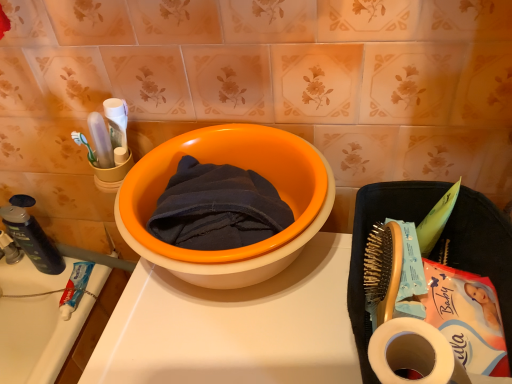
The image size is (512, 384). Find the location of `white matte toilet paper at lower right`. white matte toilet paper at lower right is located at coordinates (413, 353).

The image size is (512, 384). In order to click on dark blue cotton towel at center in this screenshot , I will do `click(217, 208)`.

What do you see at coordinates (217, 208) in the screenshot? The height and width of the screenshot is (384, 512). I see `dark blue cotton towel at center` at bounding box center [217, 208].

The height and width of the screenshot is (384, 512). I want to click on white toothpaste tube at lower left, placed as the second stationery when sorted from left to right, so click(75, 288).

Where is `white matte toilet paper at lower right`? white matte toilet paper at lower right is located at coordinates (413, 353).

From a real-world perspective, which is physically above, orange plastic basin at center or dark blue cotton towel at center?

dark blue cotton towel at center, from a real-world perspective.

Considering the sizes of objects orange plastic basin at center and dark blue cotton towel at center in the image provided, who is bigger, orange plastic basin at center or dark blue cotton towel at center?

With larger size is orange plastic basin at center.

Considering the relative sizes of orange plastic basin at center and dark blue cotton towel at center in the image provided, is orange plastic basin at center shorter than dark blue cotton towel at center?

In fact, orange plastic basin at center may be taller than dark blue cotton towel at center.

Is orange plastic basin at center spatially inside dark blue cotton towel at center, or outside of it?

The correct answer is: outside.

How many degrees apart are the facing directions of white toothpaste tube at lower left, the 1th stationery from the right, and orange plastic basin at center?

The facing directions of white toothpaste tube at lower left, the 1th stationery from the right, and orange plastic basin at center are 12.1 degrees apart.

Consider the image. Is white toothpaste tube at lower left, placed as the second stationery when sorted from left to right, oriented towards orange plastic basin at center?

No, white toothpaste tube at lower left, placed as the second stationery when sorted from left to right, is not facing towards orange plastic basin at center.

Considering the sizes of objects white toothpaste tube at lower left, the 1th stationery from the right, and orange plastic basin at center in the image provided, who is smaller, white toothpaste tube at lower left, the 1th stationery from the right, or orange plastic basin at center?

white toothpaste tube at lower left, the 1th stationery from the right, is smaller.

From a real-world perspective, is white toothpaste tube at lower left, placed as the second stationery when sorted from left to right, physically below orange plastic basin at center?

Yes, from a real-world perspective, white toothpaste tube at lower left, placed as the second stationery when sorted from left to right, is below orange plastic basin at center.

What are the coordinates of `toilet paper below the orange plastic basin at center (from the image's perspective)` in the screenshot? It's located at (413, 353).

From a real-world perspective, is white matte toilet paper at lower right beneath orange plastic basin at center?

No, from a real-world perspective, white matte toilet paper at lower right is not under orange plastic basin at center.

Considering the relative positions of white matte toilet paper at lower right and orange plastic basin at center in the image provided, is white matte toilet paper at lower right to the left of orange plastic basin at center from the viewer's perspective?

Incorrect, white matte toilet paper at lower right is not on the left side of orange plastic basin at center.

Are white matte toilet paper at lower right and orange plastic basin at center far apart?

No, white matte toilet paper at lower right is not far away from orange plastic basin at center.

Would you say dark blue plastic soap dispenser at left, which is the 1th stationery in left-to-right order, is inside or outside dark blue cotton towel at center?

dark blue plastic soap dispenser at left, which is the 1th stationery in left-to-right order, is outside dark blue cotton towel at center.

In the scene shown: From the image's perspective, is dark blue plastic soap dispenser at left, which is the 1th stationery in left-to-right order, on top of dark blue cotton towel at center?

No, from the image's perspective, dark blue plastic soap dispenser at left, which is the 1th stationery in left-to-right order, is not above dark blue cotton towel at center.

Considering the positions of objects dark blue plastic soap dispenser at left, which is the 1th stationery in left-to-right order, and dark blue cotton towel at center in the image provided, who is more to the left, dark blue plastic soap dispenser at left, which is the 1th stationery in left-to-right order, or dark blue cotton towel at center?

Positioned to the left is dark blue plastic soap dispenser at left, which is the 1th stationery in left-to-right order.

Based on the photo, from a real-world perspective, is white toothpaste tube at lower left, the 1th stationery from the right, positioned above or below white matte toilet paper at lower right?

From a real-world perspective, white toothpaste tube at lower left, the 1th stationery from the right, is physically below white matte toilet paper at lower right.

How many degrees apart are the facing directions of white toothpaste tube at lower left, the 1th stationery from the right, and white matte toilet paper at lower right?

They differ by 12.1 degrees in their facing directions.

From the image's perspective, would you say white toothpaste tube at lower left, the 1th stationery from the right, is positioned over white matte toilet paper at lower right?

Actually, white toothpaste tube at lower left, the 1th stationery from the right, appears below white matte toilet paper at lower right in the image.

Is white toothpaste tube at lower left, the 1th stationery from the right, inside orange plastic basin at center?

Definitely not — white toothpaste tube at lower left, the 1th stationery from the right, is not inside orange plastic basin at center.

Is orange plastic basin at center bigger than white toothpaste tube at lower left, the 1th stationery from the right?

Yes.

Is orange plastic basin at center placed right next to white toothpaste tube at lower left, placed as the second stationery when sorted from left to right?

No, orange plastic basin at center is not with white toothpaste tube at lower left, placed as the second stationery when sorted from left to right.

Which object is positioned more to the left, orange plastic basin at center or white toothpaste tube at lower left, the 1th stationery from the right?

white toothpaste tube at lower left, the 1th stationery from the right.

Can you confirm if orange plastic basin at center is positioned to the right of dark blue plastic soap dispenser at left, which is the 1th stationery in left-to-right order?

Yes.

Between orange plastic basin at center and dark blue plastic soap dispenser at left, which is counted as the 2th stationery, starting from the right, which one has larger width?

With larger width is orange plastic basin at center.

From the orange plastic basin at center, count 1st stationerys backward and point to it. Please provide its 2D coordinates.

[(31, 235)]

Considering the positions of objects orange plastic basin at center and dark blue plastic soap dispenser at left, which is the 1th stationery in left-to-right order, in the image provided, who is in front, orange plastic basin at center or dark blue plastic soap dispenser at left, which is the 1th stationery in left-to-right order,?

orange plastic basin at center is closer to the camera.

You are a GUI agent. You are given a task and a screenshot of the screen. Output one action in this format:
    pyautogui.click(x=<x>, y=<y>)
    Task: Click on the basin beneath the dark blue cotton towel at center (from a real-world perspective)
    The width and height of the screenshot is (512, 384).
    Given the screenshot: What is the action you would take?
    pyautogui.click(x=240, y=167)

Find the location of `basin that is above the white toothpaste tube at lower left, the 1th stationery from the right (from the image's perspective)`. basin that is above the white toothpaste tube at lower left, the 1th stationery from the right (from the image's perspective) is located at coordinates (240, 167).

Based on their spatial positions, is dark blue plastic soap dispenser at left, which is counted as the 2th stationery, starting from the right, or dark blue cotton towel at center closer to white toothpaste tube at lower left, the 1th stationery from the right?

Among the two, dark blue plastic soap dispenser at left, which is counted as the 2th stationery, starting from the right, is located nearer to white toothpaste tube at lower left, the 1th stationery from the right.

Considering their positions, is orange plastic basin at center positioned further to white matte toilet paper at lower right than white toothpaste tube at lower left, the 1th stationery from the right?

white toothpaste tube at lower left, the 1th stationery from the right, lies further to white matte toilet paper at lower right than the other object.

Based on their spatial positions, is dark blue cotton towel at center or dark blue plastic soap dispenser at left, which is the 1th stationery in left-to-right order, closer to white toothpaste tube at lower left, placed as the second stationery when sorted from left to right?

dark blue plastic soap dispenser at left, which is the 1th stationery in left-to-right order, lies closer to white toothpaste tube at lower left, placed as the second stationery when sorted from left to right, than the other object.

Which object lies nearer to the anchor point dark blue cotton towel at center, orange plastic basin at center or dark blue plastic soap dispenser at left, which is counted as the 2th stationery, starting from the right?

orange plastic basin at center is positioned closer to the anchor dark blue cotton towel at center.

Based on the photo, from the image, which object appears to be nearer to white toothpaste tube at lower left, placed as the second stationery when sorted from left to right, orange plastic basin at center or white matte toilet paper at lower right?

orange plastic basin at center is closer to white toothpaste tube at lower left, placed as the second stationery when sorted from left to right.

From the picture: Estimate the real-world distances between objects in this image. Which object is closer to orange plastic basin at center, white toothpaste tube at lower left, the 1th stationery from the right, or dark blue cotton towel at center?

Based on the image, dark blue cotton towel at center appears to be nearer to orange plastic basin at center.

From the image, which object appears to be nearer to dark blue plastic soap dispenser at left, which is counted as the 2th stationery, starting from the right, white matte toilet paper at lower right or orange plastic basin at center?

orange plastic basin at center is closer to dark blue plastic soap dispenser at left, which is counted as the 2th stationery, starting from the right.

Looking at the image, which one is located closer to orange plastic basin at center, dark blue cotton towel at center or white matte toilet paper at lower right?

Based on the image, dark blue cotton towel at center appears to be nearer to orange plastic basin at center.

Identify the location of bath towel between white toothpaste tube at lower left, the 1th stationery from the right, and white matte toilet paper at lower right from left to right. This screenshot has height=384, width=512. (217, 208).

At what (x,y) coordinates should I click in order to perform the action: click on bath towel located between dark blue plastic soap dispenser at left, which is the 1th stationery in left-to-right order, and white matte toilet paper at lower right in the left-right direction. Please return your answer as a coordinate pair (x, y). Looking at the image, I should click on (217, 208).

At what (x,y) coordinates should I click in order to perform the action: click on basin between dark blue cotton towel at center and white matte toilet paper at lower right from left to right. Please return your answer as a coordinate pair (x, y). Image resolution: width=512 pixels, height=384 pixels. Looking at the image, I should click on (240, 167).

Locate an element on the screen. Image resolution: width=512 pixels, height=384 pixels. basin between dark blue plastic soap dispenser at left, which is the 1th stationery in left-to-right order, and white matte toilet paper at lower right, in the horizontal direction is located at coordinates (240, 167).